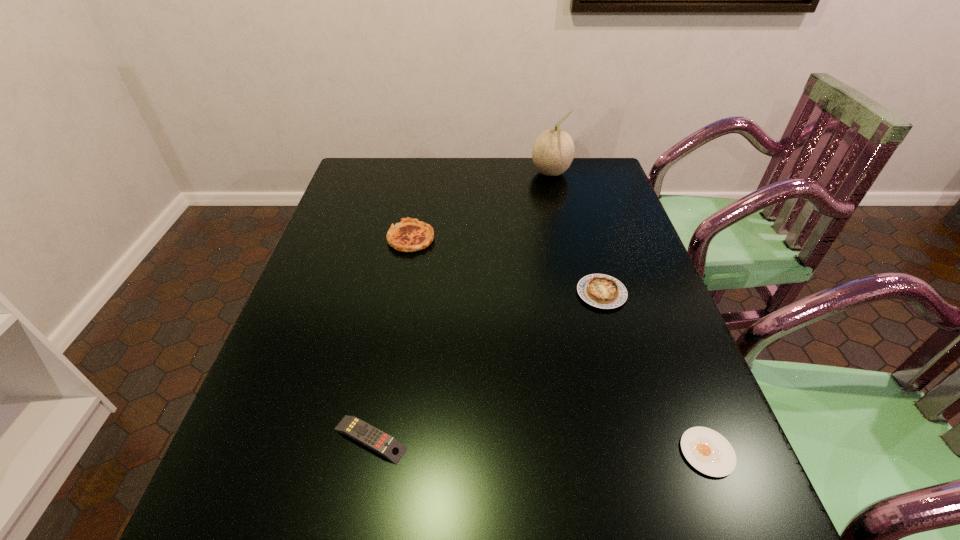
Identify the location of free spot at the left edge of the desktop. tap(254, 507).

In the image, there is a desktop. Where is `free region at the right edge`? free region at the right edge is located at coordinates (730, 485).

Where is `vacant space at the far left corner`? The image size is (960, 540). vacant space at the far left corner is located at coordinates (382, 183).

Identify the location of free area in between the farther quiche and the tallest object. This screenshot has height=540, width=960. (481, 206).

I want to click on free space between the right quiche and the taller quiche, so click(x=506, y=266).

Where is `free area in between the left quiche and the farthest object`? free area in between the left quiche and the farthest object is located at coordinates (481, 206).

At what (x,y) coordinates should I click in order to perform the action: click on empty space between the remote control and the farthest object. Please return your answer as a coordinate pair (x, y). The width and height of the screenshot is (960, 540). Looking at the image, I should click on (461, 306).

Image resolution: width=960 pixels, height=540 pixels. What are the coordinates of `vacant space in between the third farthest object and the second shortest object` in the screenshot? It's located at (486, 366).

Locate an element on the screen. The height and width of the screenshot is (540, 960). empty location between the farthest object and the remote control is located at coordinates (461, 306).

Find the location of `vacant space that is in between the third nearest object and the left quiche`. vacant space that is in between the third nearest object and the left quiche is located at coordinates (506, 266).